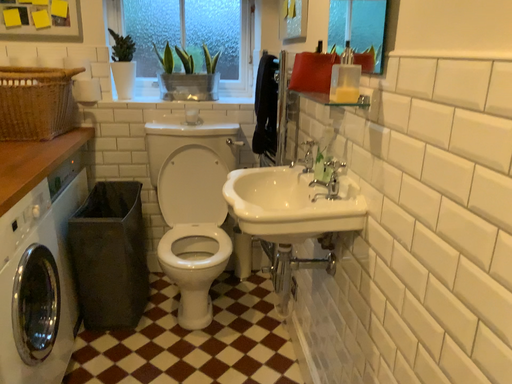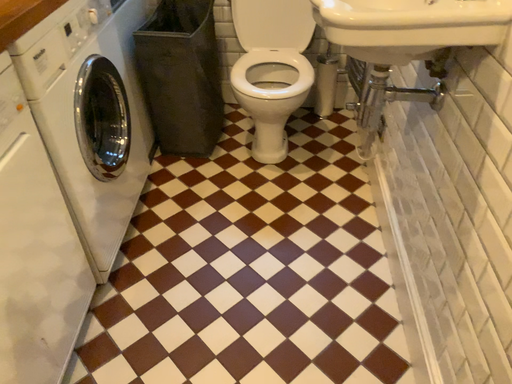
Question: How did the camera likely rotate when shooting the video?

Choices:
 (A) rotated upward
 (B) rotated downward

Answer: (B)